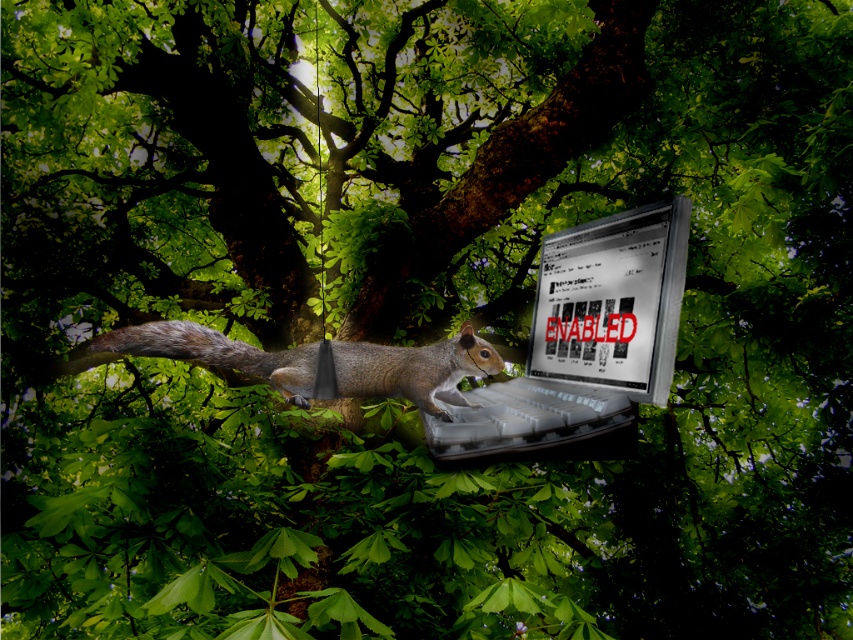
From the picture: You are a photographer planning to capture the metallic silver laptop at center and the shiny silver laptop at center in a single frame. Since both are placed on the same tree branch, which laptop should you focus on first to ensure both are in the frame without moving the camera?

You should focus on the metallic silver laptop at center first because it is positioned to the left of the shiny silver laptop at center, so by centering your focus on the leftmost laptop, you can ensure both are within the frame without needing to adjust the camera position.

You are a wildlife photographer trying to capture a shot of the fuzzy brown tail at center and the metallic silver laptop at center. Since you want both subjects to be clearly visible in the frame, which object should you focus on first to ensure proper depth of field?

The metallic silver laptop at center has a greater height compared to the fuzzy brown tail at center, so you should focus on the metallic silver laptop at center first to ensure proper depth of field.

You are a photographer trying to capture both the metallic silver laptop at center and the shiny silver laptop at center in a single photo. Which laptop will appear closer to the camera in your photo?

The metallic silver laptop at center will appear closer to the camera because it is positioned in front of the shiny silver laptop at center.